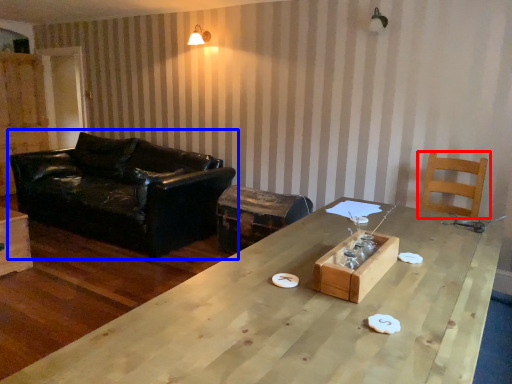
Question: Which point is closer to the camera, chair (highlighted by a red box) or studio couch (highlighted by a blue box)?

Choices:
 (A) chair
 (B) studio couch

Answer: (A)